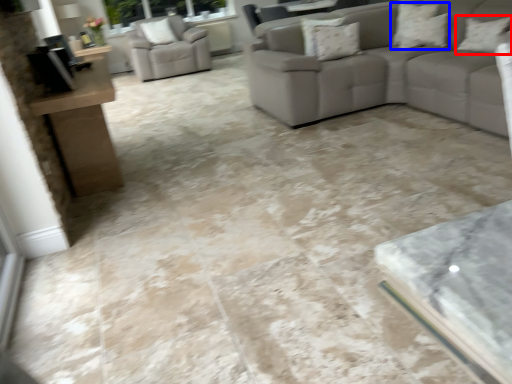
Question: Which object appears closest to the camera in this image, pillow (highlighted by a red box) or pillow (highlighted by a blue box)?

Choices:
 (A) pillow
 (B) pillow

Answer: (A)